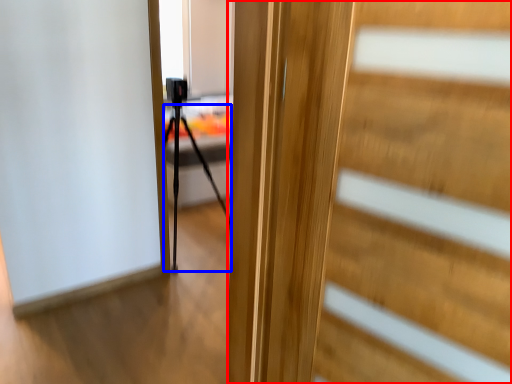
Question: Which object is closer to the camera taking this photo, door (highlighted by a red box) or tripod (highlighted by a blue box)?

Choices:
 (A) door
 (B) tripod

Answer: (A)